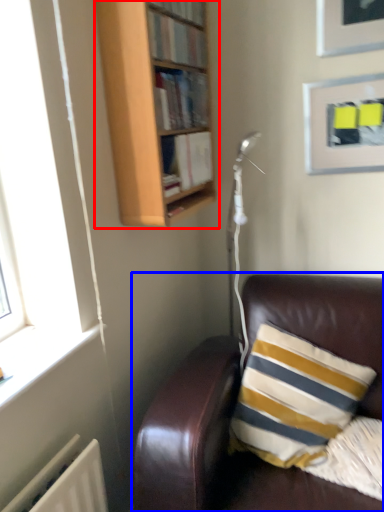
Question: Which of the following is the farthest to the observer, bookcase (highlighted by a red box) or studio couch (highlighted by a blue box)?

Choices:
 (A) bookcase
 (B) studio couch

Answer: (A)